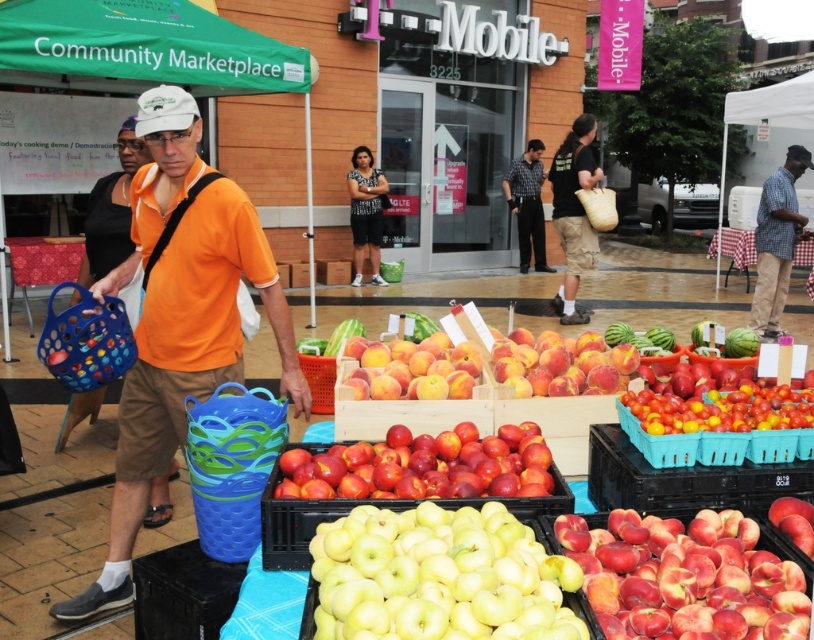
Question: Is blue plastic basket at left below orange plastic crate at center?

Choices:
 (A) no
 (B) yes

Answer: (A)

Question: Is shiny red tomatoes at center to the right of blue plastic basket at left from the viewer's perspective?

Choices:
 (A) no
 (B) yes

Answer: (B)

Question: Which point is farther to the camera?

Choices:
 (A) checkered fabric shirt at right
 (B) orange plastic crate at center
 (C) shiny red tomatoes at center
 (D) orange cotton shirt at center

Answer: (A)

Question: Which of the following is the farthest from the observer?

Choices:
 (A) (318, 378)
 (B) (672, 413)
 (C) (322, 602)
 (D) (352, 195)

Answer: (D)

Question: Which object appears farthest from the camera in this image?

Choices:
 (A) green fabric canopy at upper left
 (B) dark gray/black fabric shirt at center
 (C) checkered fabric shirt at right
 (D) yellow matte apples at center

Answer: (B)

Question: Does yellow matte apples at center have a larger size compared to checkered shirt at center?

Choices:
 (A) yes
 (B) no

Answer: (B)